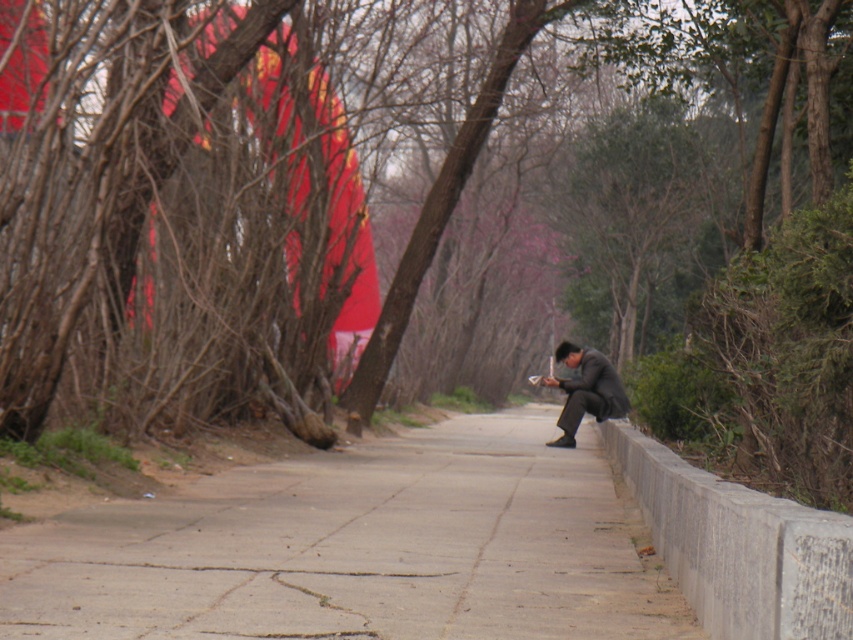
Is concrete at right taller than dark gray suit at center?

Incorrect, concrete at right's height is not larger of dark gray suit at center's.

Between concrete at right and dark gray suit at center, which one appears on the left side from the viewer's perspective?

concrete at right

The image size is (853, 640). What do you see at coordinates (358, 548) in the screenshot? I see `concrete at right` at bounding box center [358, 548].

The width and height of the screenshot is (853, 640). Find the location of `concrete at right`. concrete at right is located at coordinates (358, 548).

Who is more forward, (369, 92) or (93, 566)?

Point (93, 566) is in front.

This screenshot has height=640, width=853. In order to click on brown bark tree at center in this screenshot , I will do `click(360, 188)`.

Between point (20, 176) and point (263, 584), which one is positioned in front?

Point (263, 584) is more forward.

Image resolution: width=853 pixels, height=640 pixels. I want to click on brown bark tree at center, so pos(360,188).

Is point (646, 493) closer to camera compared to point (556, 380)?

That is True.

Does point (662, 488) come closer to viewer compared to point (616, 401)?

Yes.

You are a GUI agent. You are given a task and a screenshot of the screen. Output one action in this format:
    pyautogui.click(x=<x>, y=<y>)
    Task: Click on the gray concrete ledge at lower right
    The image size is (853, 640).
    Given the screenshot: What is the action you would take?
    pyautogui.click(x=740, y=547)